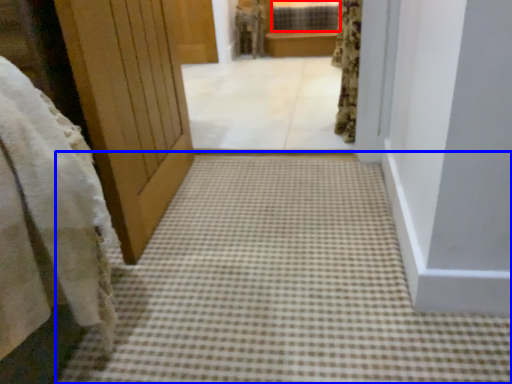
Question: Which point is closer to the camera, window (highlighted by a red box) or path (highlighted by a blue box)?

Choices:
 (A) window
 (B) path

Answer: (B)